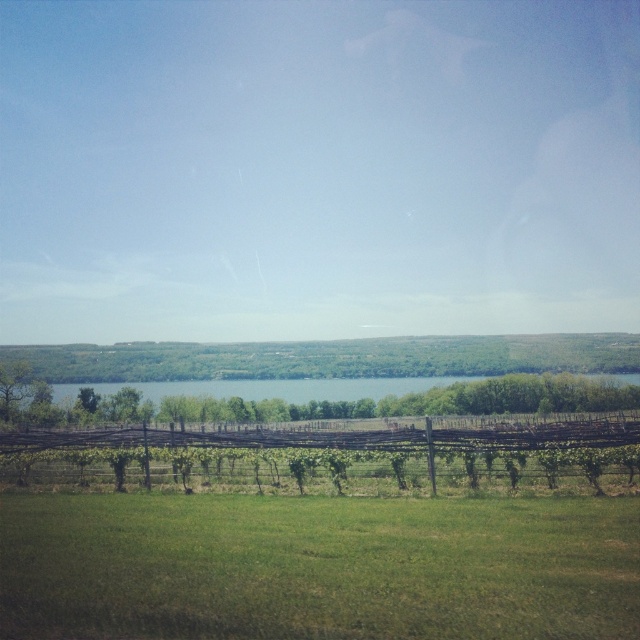
Can you confirm if green grassy field at lower center is positioned to the right of brown wooden fence at center?

Indeed, green grassy field at lower center is positioned on the right side of brown wooden fence at center.

How much distance is there between green grassy field at lower center and brown wooden fence at center?

The distance of green grassy field at lower center from brown wooden fence at center is 11.36 meters.

Does point (467, 513) come farther from viewer compared to point (634, 416)?

No, it is in front of (634, 416).

Find the location of `green grassy field at lower center`. green grassy field at lower center is located at coordinates (316, 566).